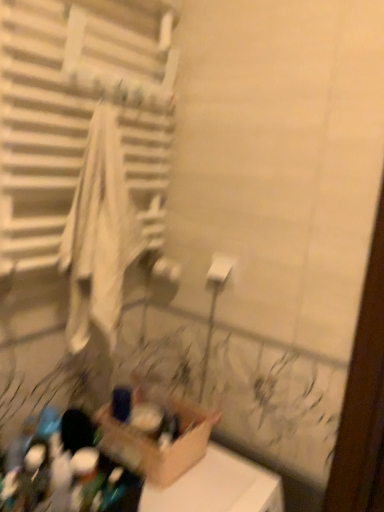
Question: From a real-world perspective, is white fabric towel at left positioned under cardboard box at lower center based on gravity?

Choices:
 (A) yes
 (B) no

Answer: (B)

Question: Considering the relative sizes of white fabric towel at left and cardboard box at lower center in the image provided, is white fabric towel at left taller than cardboard box at lower center?

Choices:
 (A) yes
 (B) no

Answer: (A)

Question: From the image's perspective, is white fabric towel at left on cardboard box at lower center?

Choices:
 (A) no
 (B) yes

Answer: (B)

Question: From the image's perspective, is white fabric towel at left below cardboard box at lower center?

Choices:
 (A) yes
 (B) no

Answer: (B)

Question: Does white fabric towel at left have a lesser width compared to cardboard box at lower center?

Choices:
 (A) no
 (B) yes

Answer: (B)

Question: Is white fabric towel at left at the right side of cardboard box at lower center?

Choices:
 (A) yes
 (B) no

Answer: (B)

Question: Considering the relative sizes of cardboard box at lower center and white fabric towel at left in the image provided, is cardboard box at lower center bigger than white fabric towel at left?

Choices:
 (A) no
 (B) yes

Answer: (A)

Question: Is cardboard box at lower center aimed at white fabric towel at left?

Choices:
 (A) yes
 (B) no

Answer: (B)

Question: Is cardboard box at lower center shorter than white fabric towel at left?

Choices:
 (A) no
 (B) yes

Answer: (B)

Question: Is cardboard box at lower center not close to white fabric towel at left?

Choices:
 (A) no
 (B) yes

Answer: (A)

Question: Could white fabric towel at left be considered to be inside cardboard box at lower center?

Choices:
 (A) no
 (B) yes

Answer: (A)

Question: Is cardboard box at lower center looking in the opposite direction of white fabric towel at left?

Choices:
 (A) yes
 (B) no

Answer: (B)

Question: Can you confirm if white fabric towel at left is positioned to the left of white matte toilet paper at center?

Choices:
 (A) yes
 (B) no

Answer: (A)